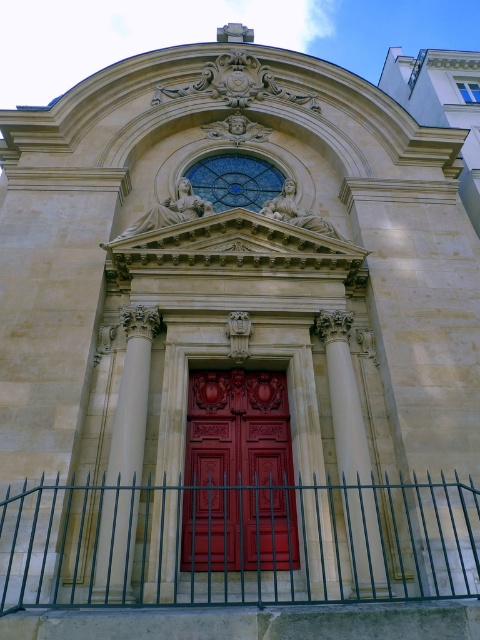
Question: Can you confirm if glossy wood door at center is thinner than white stone column at center?

Choices:
 (A) no
 (B) yes

Answer: (A)

Question: Which point appears closest to the camera in this image?

Choices:
 (A) (123, 486)
 (B) (98, 600)

Answer: (B)

Question: Which point is closer to the camera?

Choices:
 (A) glossy wood door at center
 (B) green metal fence at center

Answer: (B)

Question: Is green metal fence at center to the left of white stone column at center from the viewer's perspective?

Choices:
 (A) no
 (B) yes

Answer: (B)

Question: Based on their relative distances, which object is nearer to the smooth stone column at center?

Choices:
 (A) glossy wood door at center
 (B) white stone column at center

Answer: (A)

Question: Is smooth stone column at center closer to camera compared to white stone column at center?

Choices:
 (A) no
 (B) yes

Answer: (B)